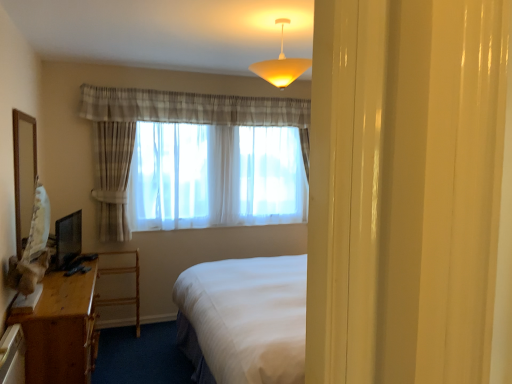
Question: Relative to sheer white curtain at center, is matte yellow plastic lampshade at upper center in front or behind?

Choices:
 (A) front
 (B) behind

Answer: (A)

Question: From a real-world perspective, relative to sheer white curtain at center, is matte yellow plastic lampshade at upper center vertically above or below?

Choices:
 (A) above
 (B) below

Answer: (A)

Question: Estimate the real-world distances between objects in this image. Which object is farther from the sheer white curtain at center?

Choices:
 (A) wooden desk at left
 (B) matte yellow plastic lampshade at upper center
 (C) wooden desk at lower left
 (D) matte black monitor at left
 (E) wooden mirror at left

Answer: (B)

Question: Which object is positioned farthest from the matte yellow plastic lampshade at upper center?

Choices:
 (A) matte black monitor at left
 (B) sheer white curtain at center
 (C) wooden desk at left
 (D) wooden mirror at left
 (E) wooden desk at lower left

Answer: (C)